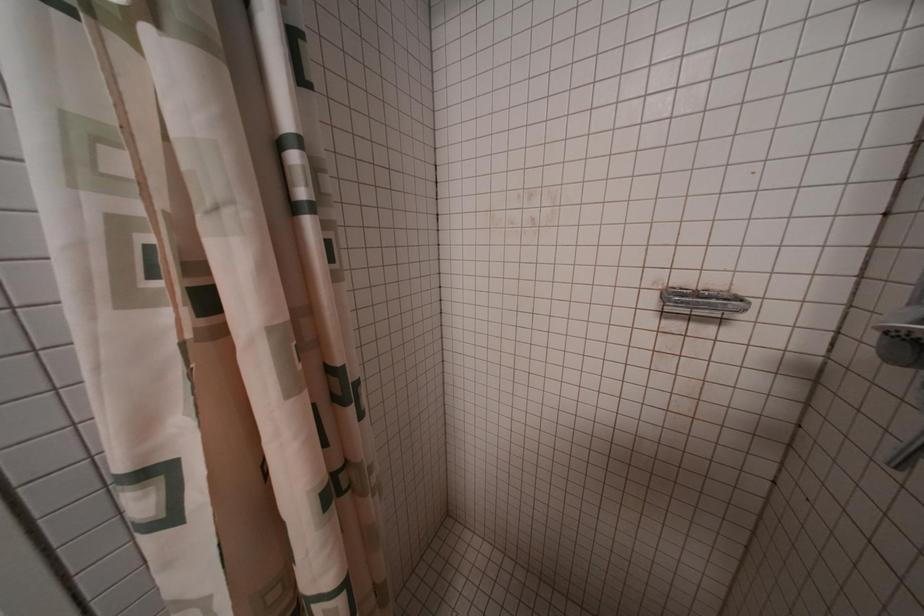
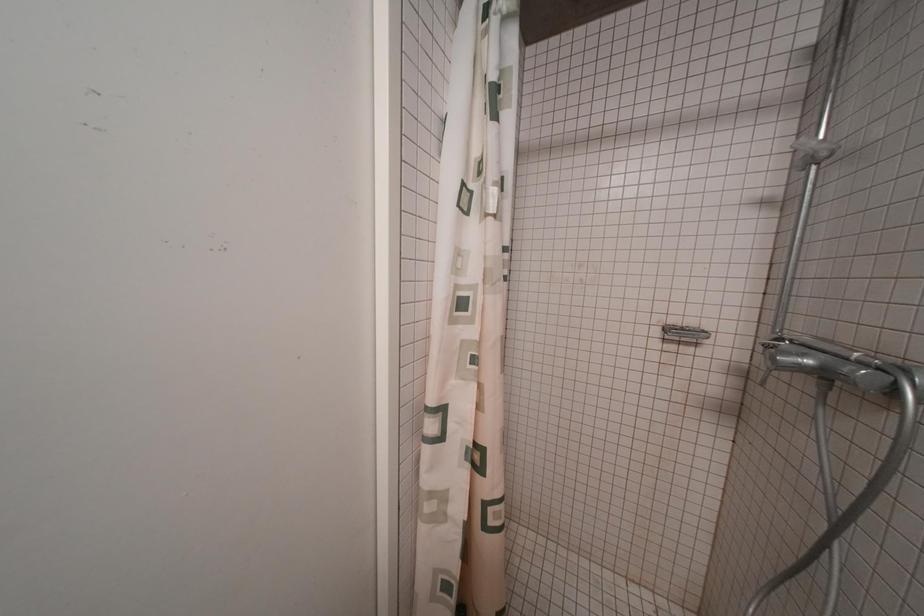
Question: The first image is from the beginning of the video and the second image is from the end. How did the camera likely rotate when shooting the video?

Choices:
 (A) Left
 (B) Right
 (C) Up
 (D) Down

Answer: (C)